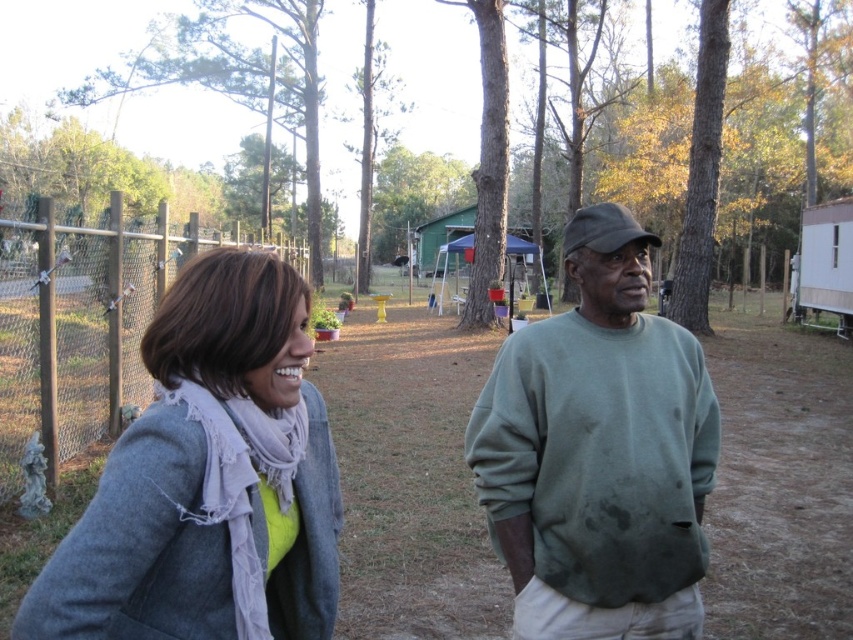
Where is `gray sweater at center`? gray sweater at center is located at coordinates (599, 451).

Who is positioned more to the left, gray sweater at center or green matte sweatshirt at center?

From the viewer's perspective, green matte sweatshirt at center appears more on the left side.

Who is more distant from viewer, [550,488] or [700,360]?

The point [700,360] is more distant.

Identify the location of gray sweater at center. The image size is (853, 640). 599,451.

Can you confirm if gray woolen coat at left is positioned to the right of green matte sweatshirt at center?

Incorrect, gray woolen coat at left is not on the right side of green matte sweatshirt at center.

Is gray woolen coat at left positioned before green matte sweatshirt at center?

Yes, it is.

Identify the location of gray woolen coat at left. This screenshot has height=640, width=853. (209, 477).

Does gray sweater at center have a larger size compared to gray woolen coat at left?

Correct, gray sweater at center is larger in size than gray woolen coat at left.

Where is `gray sweater at center`? The width and height of the screenshot is (853, 640). gray sweater at center is located at coordinates (599, 451).

Image resolution: width=853 pixels, height=640 pixels. I want to click on gray sweater at center, so click(x=599, y=451).